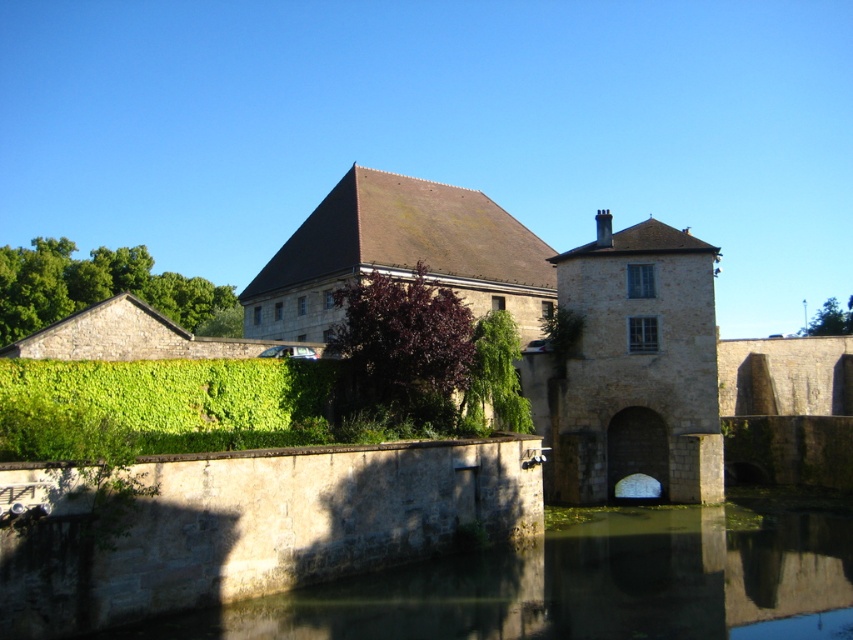
Does green leafy hedge at center have a larger size compared to green leafy hedge at upper left?

No, green leafy hedge at center is not bigger than green leafy hedge at upper left.

Can you confirm if green leafy hedge at center is smaller than green leafy hedge at upper left?

Indeed, green leafy hedge at center has a smaller size compared to green leafy hedge at upper left.

Is point (436, 323) positioned behind point (6, 276)?

No, it is not.

At what (x,y) coordinates should I click in order to perform the action: click on green leafy hedge at center. Please return your answer as a coordinate pair (x, y). Looking at the image, I should click on (403, 348).

Does green leafy hedge at lower left have a lesser width compared to green leafy hedge at center?

Correct, green leafy hedge at lower left's width is less than green leafy hedge at center's.

Does green leafy hedge at lower left come in front of green leafy hedge at center?

Yes, it is.

Which is in front, point (38, 422) or point (357, 368)?

Point (38, 422) is more forward.

Identify the location of green leafy hedge at lower left. (158, 406).

Which is below, green leafy hedge at lower left or green leafy hedge at upper left?

green leafy hedge at lower left is lower down.

Between green leafy hedge at lower left and green leafy hedge at upper left, which one appears on the right side from the viewer's perspective?

Positioned to the right is green leafy hedge at lower left.

Who is more distant from viewer, [199,381] or [195,320]?

Positioned behind is point [195,320].

At what (x,y) coordinates should I click in order to perform the action: click on green leafy hedge at lower left. Please return your answer as a coordinate pair (x, y). Looking at the image, I should click on (158, 406).